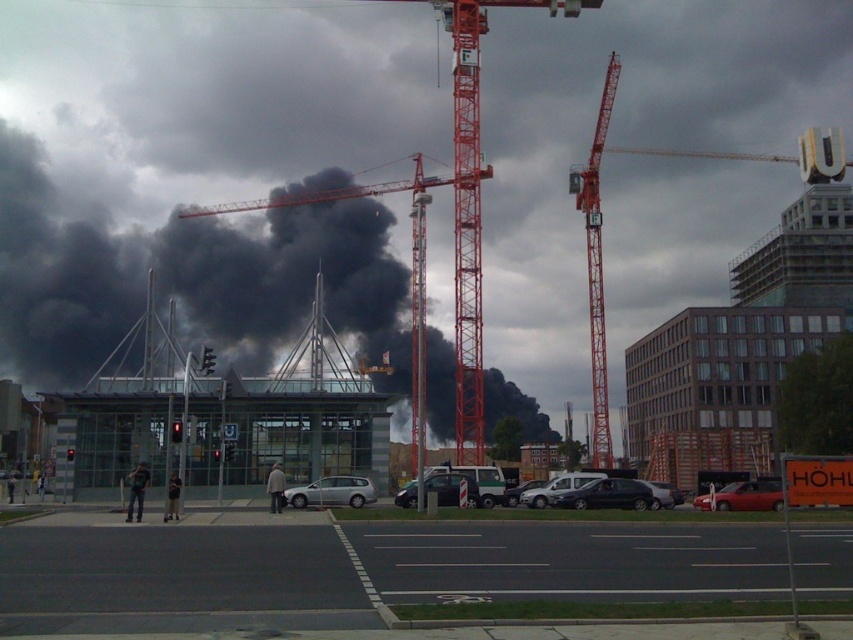
Question: Does orange metallic crane at right have a greater width compared to satin silver van at center?

Choices:
 (A) no
 (B) yes

Answer: (B)

Question: Estimate the real-world distances between objects in this image. Which object is closer to the shiny black sedan at center?

Choices:
 (A) orange metallic crane at upper right
 (B) satin silver van at center

Answer: (B)

Question: Which point appears closest to the camera in this image?

Choices:
 (A) (592, 301)
 (B) (476, 259)

Answer: (B)

Question: Observing the image, what is the correct spatial positioning of red metal crane at center in reference to shiny black sedan at center?

Choices:
 (A) below
 (B) above

Answer: (B)

Question: Which object is closer to the camera taking this photo?

Choices:
 (A) satin silver van at center
 (B) red metal crane at center
 (C) black smoke at center
 (D) shiny black sedan at center

Answer: (B)

Question: Can you confirm if red metal crane at center is bigger than satin silver van at center?

Choices:
 (A) yes
 (B) no

Answer: (A)